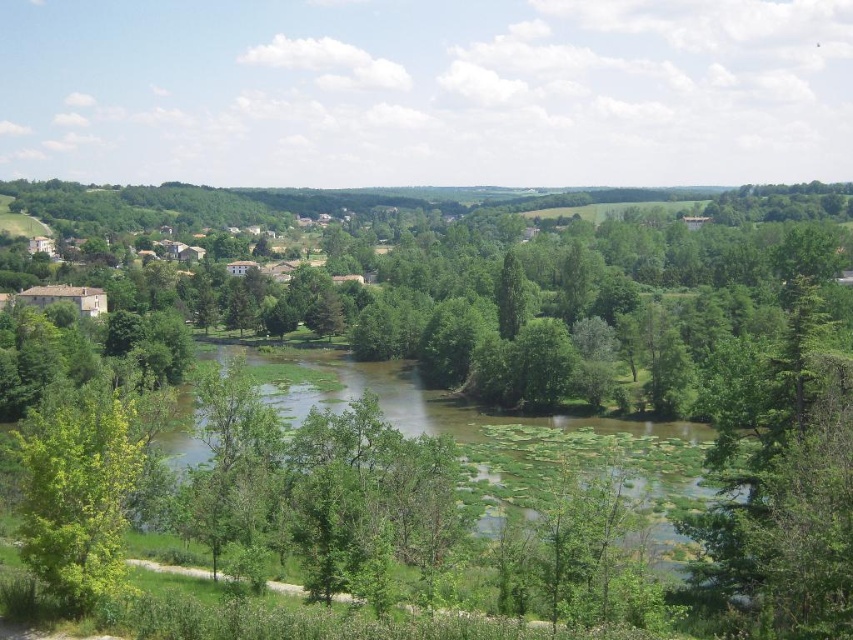
Question: Among these objects, which one is nearest to the camera?

Choices:
 (A) green leafy river at center
 (B) green leafy tree at center
 (C) green leafy tree at lower left

Answer: (B)

Question: Which object is farther from the camera taking this photo?

Choices:
 (A) green leafy tree at lower left
 (B) green leafy tree at center

Answer: (A)

Question: Among these points, which one is nearest to the camera?

Choices:
 (A) (36, 458)
 (B) (479, 524)

Answer: (A)

Question: Can you confirm if green leafy river at center is thinner than green leafy tree at lower left?

Choices:
 (A) no
 (B) yes

Answer: (A)

Question: Can you confirm if green leafy river at center is wider than green leafy tree at lower left?

Choices:
 (A) no
 (B) yes

Answer: (B)

Question: Does green leafy river at center appear under green leafy tree at lower left?

Choices:
 (A) no
 (B) yes

Answer: (B)